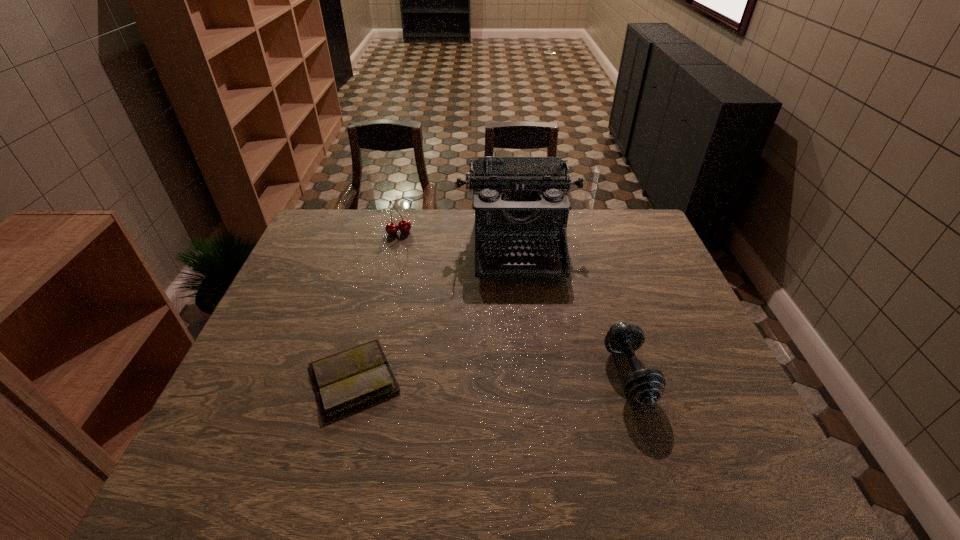
What are the coordinates of `diary` in the screenshot? It's located at (345, 381).

I want to click on dumbbell, so pyautogui.click(x=644, y=386).

Identify the location of the third shortest object. (404, 226).

Where is `the tallest object`? Image resolution: width=960 pixels, height=540 pixels. the tallest object is located at coordinates (519, 201).

Locate an element on the screen. The height and width of the screenshot is (540, 960). vacant space located on the left of the shortest object is located at coordinates (276, 379).

This screenshot has width=960, height=540. Find the location of `free location located on the left of the dumbbell`. free location located on the left of the dumbbell is located at coordinates (470, 374).

The height and width of the screenshot is (540, 960). I want to click on vacant area situated with the stems of the cherry pointing upwards, so click(414, 267).

Identify the location of free space located with the stems of the cherry pointing upwards. (419, 277).

Find the location of `vacant space located with the stems of the cherry pointing upwards`. vacant space located with the stems of the cherry pointing upwards is located at coordinates (406, 247).

This screenshot has height=540, width=960. In order to click on vacant space located 0.050m on the typing side of the tallest object in this screenshot , I will do `click(523, 294)`.